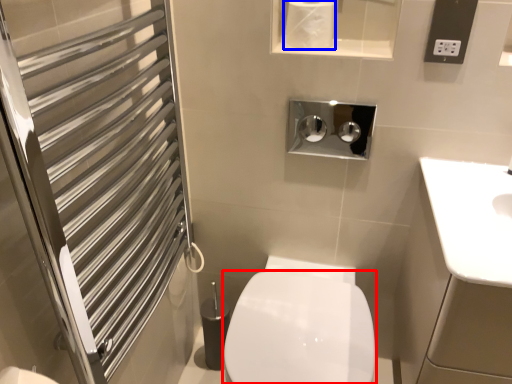
Question: Which object appears closest to the camera in this image, bidet (highlighted by a red box) or toilet paper (highlighted by a blue box)?

Choices:
 (A) bidet
 (B) toilet paper

Answer: (A)